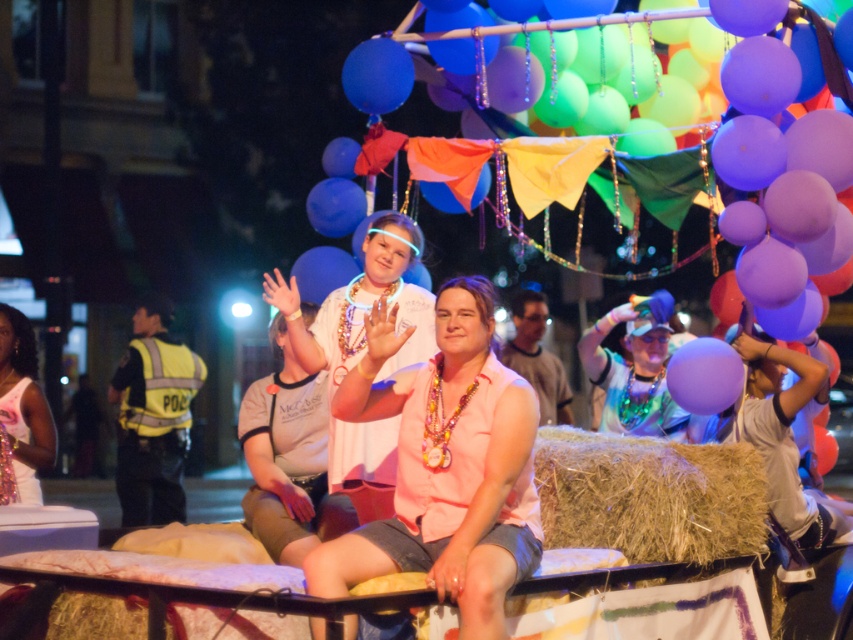
Does pink fabric shirt at center have a greater width compared to blue glossy balloon at upper center?

Indeed, pink fabric shirt at center has a greater width compared to blue glossy balloon at upper center.

Between pink fabric shirt at center and blue glossy balloon at upper center, which one is positioned lower?

pink fabric shirt at center is below.

Looking at this image, who is more distant from viewer, (314, 620) or (366, 74)?

Positioned behind is point (366, 74).

Locate an element on the screen. This screenshot has width=853, height=640. pink fabric shirt at center is located at coordinates (440, 464).

Between purple matte balloon at center and blue glossy balloon at upper center, which one appears on the right side from the viewer's perspective?

purple matte balloon at center is more to the right.

Is point (732, 369) more distant than point (358, 81)?

No, it is not.

The image size is (853, 640). In order to click on purple matte balloon at center in this screenshot , I will do `click(704, 376)`.

From the picture: Measure the distance from yellow reflective vest at left to blue glossy balloon at upper center.

yellow reflective vest at left and blue glossy balloon at upper center are 6.38 meters apart from each other.

Is point (119, 467) more distant than point (370, 104)?

That is True.

This screenshot has width=853, height=640. Find the location of `yellow reflective vest at left`. yellow reflective vest at left is located at coordinates (154, 417).